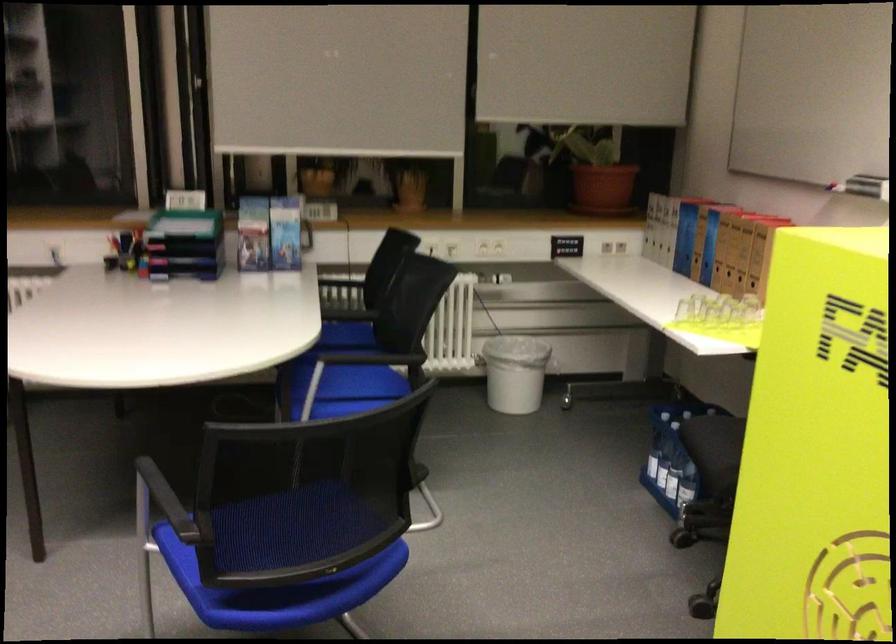
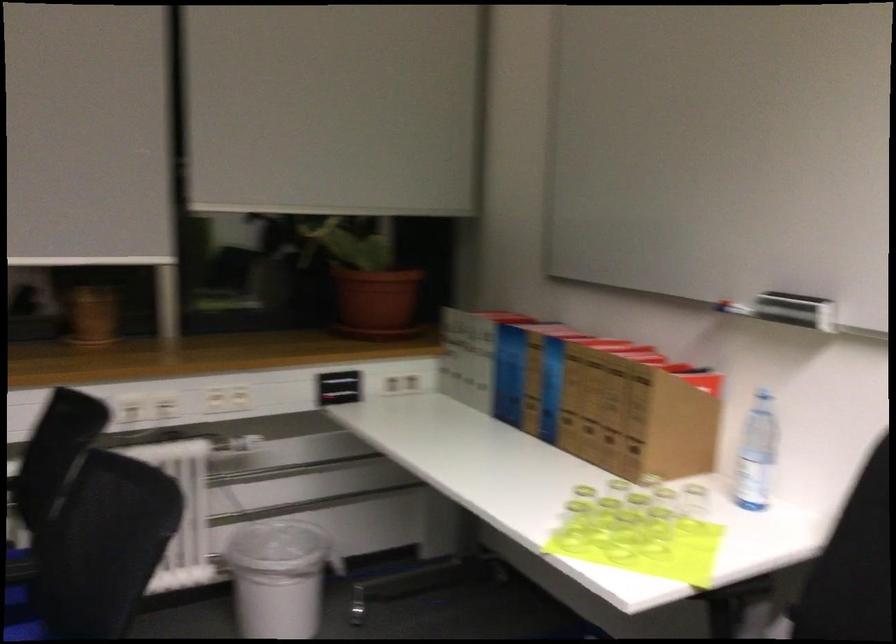
The point at (692,316) is marked in the first image. Where is the corresponding point in the second image?

(573, 526)